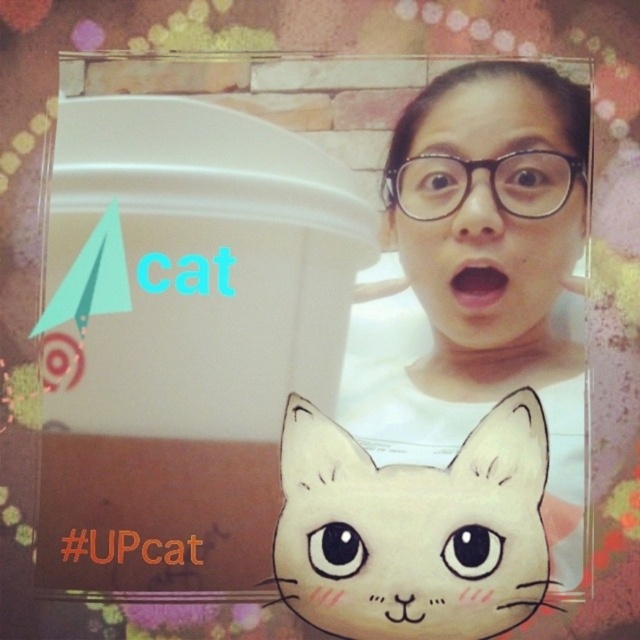
Question: Among these objects, which one is nearest to the camera?

Choices:
 (A) white matte face at center
 (B) matte white cat face at center

Answer: (B)

Question: Can you confirm if white matte face at center is positioned to the left of matte plastic face at upper center?

Choices:
 (A) no
 (B) yes

Answer: (B)

Question: Among these objects, which one is nearest to the camera?

Choices:
 (A) white matte face at center
 (B) matte plastic face at upper center

Answer: (A)

Question: Does white matte face at center have a lesser width compared to matte plastic face at upper center?

Choices:
 (A) yes
 (B) no

Answer: (B)

Question: Can you confirm if matte white cat face at center is bigger than matte plastic face at upper center?

Choices:
 (A) yes
 (B) no

Answer: (A)

Question: Among these objects, which one is farthest from the camera?

Choices:
 (A) matte plastic face at upper center
 (B) matte white cat face at center
 (C) white matte face at center

Answer: (A)